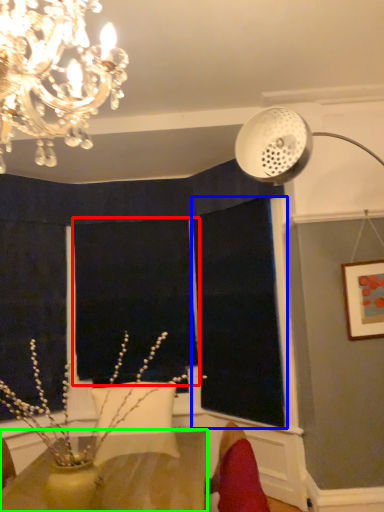
Question: Considering the real-world distances, which object is closest to window screen (highlighted by a red box)? window screen (highlighted by a blue box) or table (highlighted by a green box).

Choices:
 (A) window screen
 (B) table

Answer: (A)